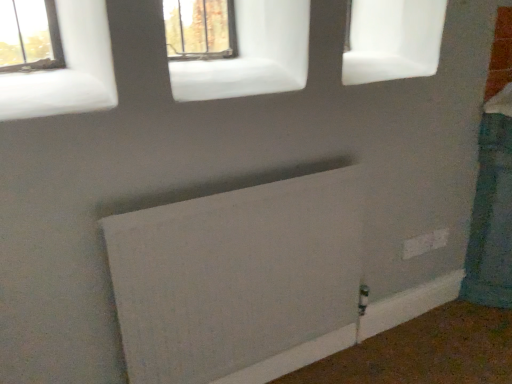
Question: Would you say matte glass window at upper center, positioned as the first window in back-to-front order, is outside white plastic electric outlet at lower right?

Choices:
 (A) no
 (B) yes

Answer: (B)

Question: Is the depth of matte glass window at upper center, the 1th window from the top, less than that of white plastic electric outlet at lower right?

Choices:
 (A) yes
 (B) no

Answer: (A)

Question: From the image's perspective, is matte glass window at upper center, positioned as the first window in back-to-front order, located beneath white plastic electric outlet at lower right?

Choices:
 (A) yes
 (B) no

Answer: (B)

Question: Can white plastic electric outlet at lower right be found inside matte glass window at upper center, positioned as the first window in back-to-front order?

Choices:
 (A) no
 (B) yes

Answer: (A)

Question: Can you confirm if matte glass window at upper center, the 1th window positioned from the right, is taller than white plastic electric outlet at lower right?

Choices:
 (A) no
 (B) yes

Answer: (B)

Question: Is white matte window at upper left, which is the first window from left to right, inside the boundaries of white plastic electric outlet at lower right, or outside?

Choices:
 (A) outside
 (B) inside

Answer: (A)

Question: Relative to white plastic electric outlet at lower right, is white matte window at upper left, which appears as the first window when ordered from the bottom, in front or behind?

Choices:
 (A) behind
 (B) front

Answer: (B)

Question: From the image's perspective, is white matte window at upper left, the second window when ordered from top to bottom, above or below white plastic electric outlet at lower right?

Choices:
 (A) below
 (B) above

Answer: (B)

Question: From a real-world perspective, is white matte window at upper left, which is the first window from left to right, physically located above or below white plastic electric outlet at lower right?

Choices:
 (A) above
 (B) below

Answer: (A)

Question: Do you think white plastic electric outlet at lower right is within white matte window at upper left, the second window when ordered from top to bottom, or outside of it?

Choices:
 (A) outside
 (B) inside

Answer: (A)

Question: From their relative heights in the image, would you say white plastic electric outlet at lower right is taller or shorter than white matte window at upper left, the 2th window positioned from the right?

Choices:
 (A) short
 (B) tall

Answer: (A)

Question: From the image's perspective, is white plastic electric outlet at lower right located above or below white matte window at upper left, the 2th window positioned from the right?

Choices:
 (A) above
 (B) below

Answer: (B)

Question: In terms of size, does white plastic electric outlet at lower right appear bigger or smaller than white matte window at upper left, which ranks as the 2th window in back-to-front order?

Choices:
 (A) small
 (B) big

Answer: (A)

Question: Considering the relative positions of white matte window at upper left, the 2th window positioned from the right, and matte glass window at upper center, which is the second window in bottom-to-top order, in the image provided, is white matte window at upper left, the 2th window positioned from the right, to the left or to the right of matte glass window at upper center, which is the second window in bottom-to-top order,?

Choices:
 (A) left
 (B) right

Answer: (A)

Question: In the image, is white matte window at upper left, the 1th window in the front-to-back sequence, positioned in front of or behind matte glass window at upper center, the 1th window from the top?

Choices:
 (A) front
 (B) behind

Answer: (A)